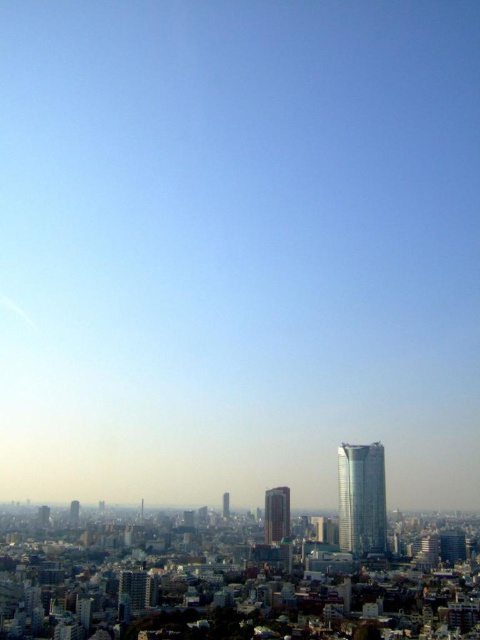
You are a city planner reviewing the city layout. You notice two prominent buildings in the center of the image, the smooth glass skyscraper at center and the smooth gold tower at center. Which one is positioned to the right when viewed from your perspective?

The smooth glass skyscraper at center is positioned to the right of the smooth gold tower at center.

You are a city planner assessing the skyline. You need to determine which of the two buildings, the silver metallic tower at right or the smooth glass skyscraper at center, would block sunlight to the neighboring park located to the east of the buildings. Based on their heights, which building is more likely to cast a shadow over the park?

The silver metallic tower at right is taller than the smooth glass skyscraper at center, so it would cast a larger shadow and is more likely to block sunlight to the neighboring park located to the east.

You are a drone operator planning to fly a drone between the silver metallic tower at right and the smooth gold tower at center. The drone has a maximum flight distance of 400 feet. Can the drone safely travel between these two towers without exceeding its range?

The silver metallic tower at right and smooth gold tower at center are 385.27 feet apart. Since the drone has a maximum flight distance of 400 feet, it can safely travel between them without exceeding its range.